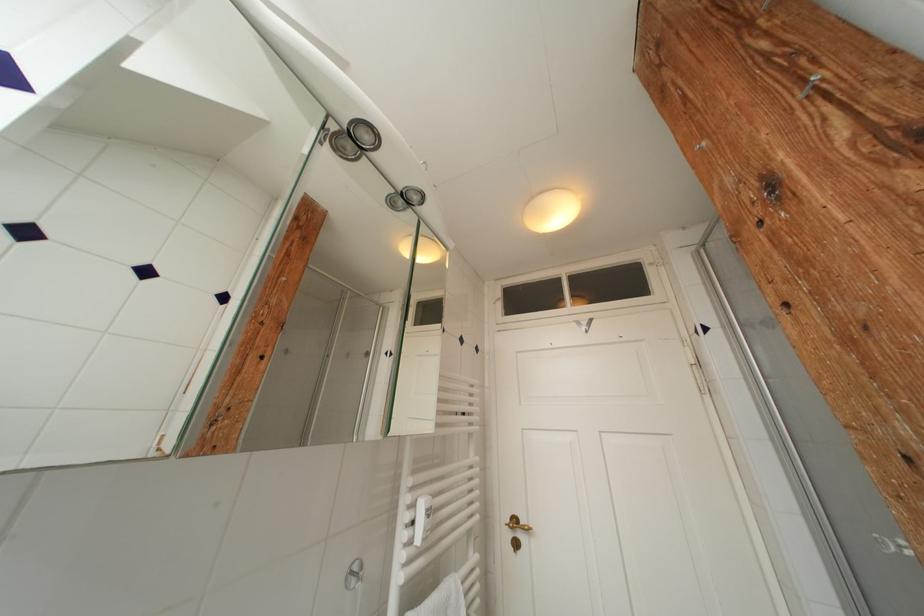
I want to click on door keyhole, so click(x=516, y=544).